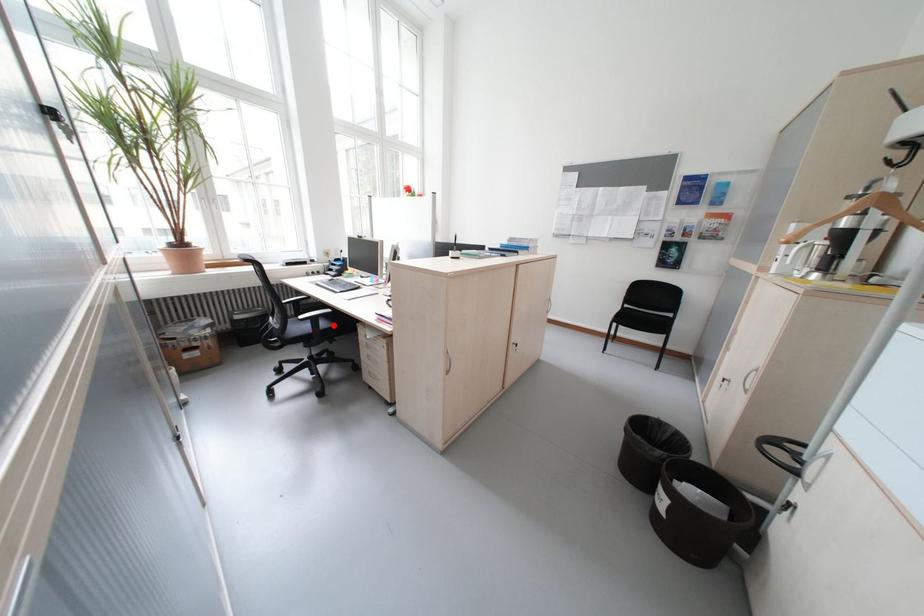
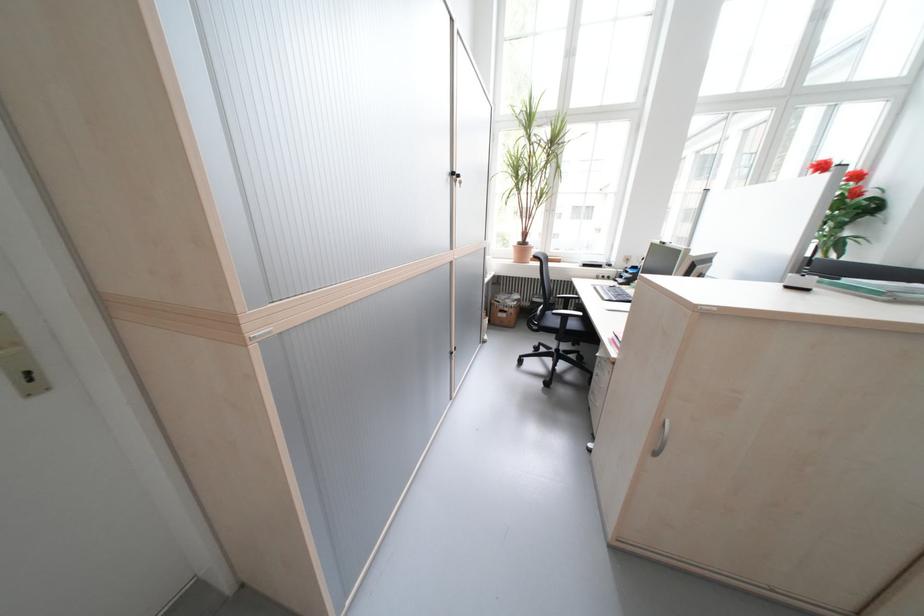
Where in the second image is the point corresponding to the highlighted location from the first image?

(582, 326)